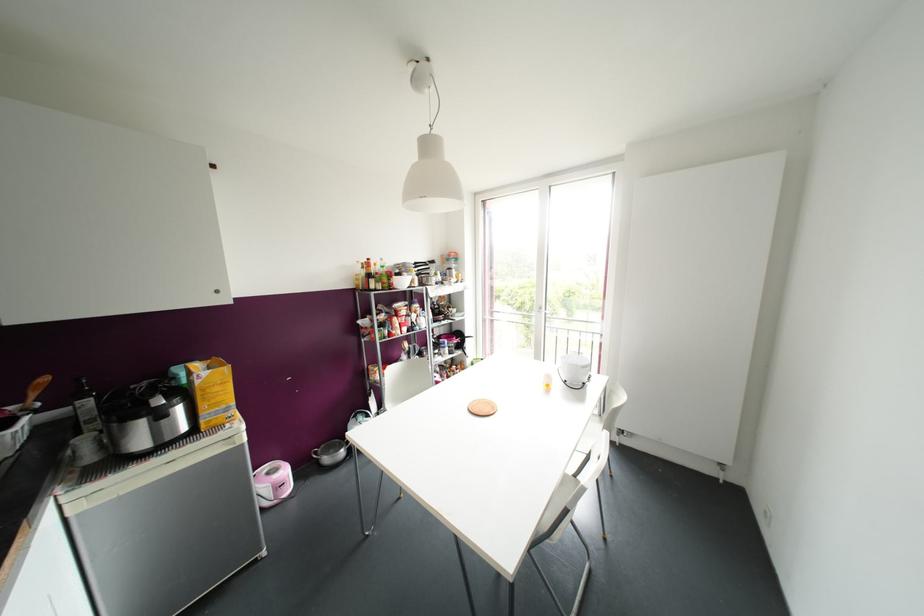
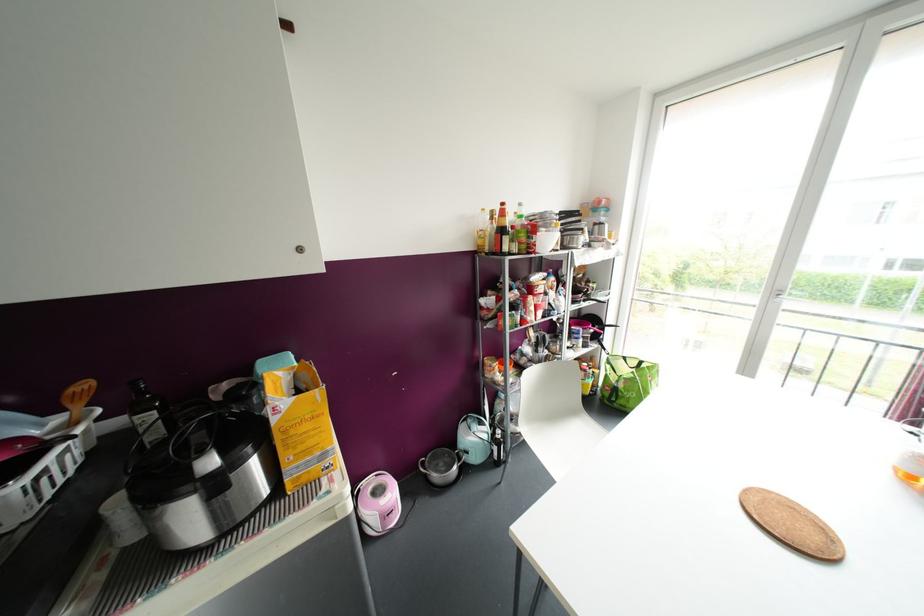
Question: The images are taken continuously from a first-person perspective. In which direction is your viewpoint rotating?

Choices:
 (A) Left
 (B) Right
 (C) Up
 (D) Down

Answer: (A)